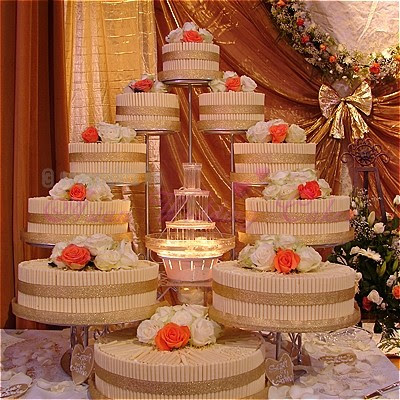
Locate an element on the screen. This screenshot has width=400, height=400. brown curtain is located at coordinates [x=21, y=160].